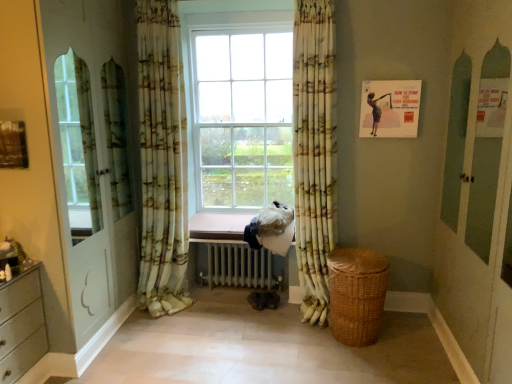
You are a GUI agent. You are given a task and a screenshot of the screen. Output one action in this format:
    pyautogui.click(x=<x>, y=<y>)
    Task: Click on the vacant space to the left of yellow-green floral fabric curtain at center, the second curtain when ordered from left to right
    The height and width of the screenshot is (384, 512).
    Given the screenshot: What is the action you would take?
    271,326